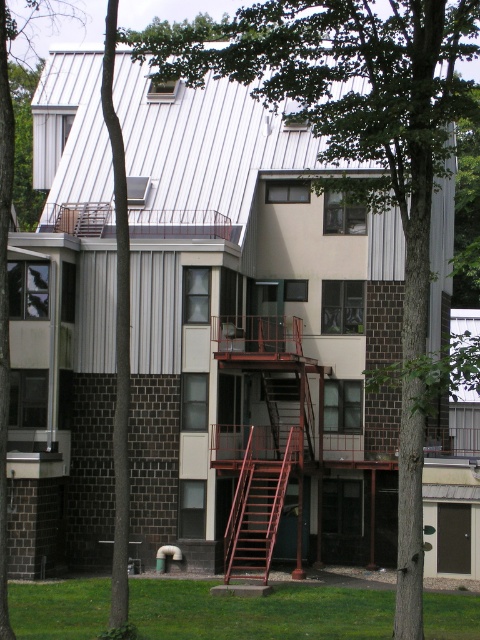
Question: Which object appears closest to the camera in this image?

Choices:
 (A) rusty metal fire escape at center
 (B) metallic red staircase at center
 (C) green leafy tree at center

Answer: (C)

Question: Does green leafy tree at center have a lesser width compared to metallic red staircase at center?

Choices:
 (A) yes
 (B) no

Answer: (B)

Question: Which point is farther from the camera taking this photo?

Choices:
 (A) (283, 385)
 (B) (3, 156)

Answer: (A)

Question: Is rusty metal staircase at center to the right of metallic red staircase at center from the viewer's perspective?

Choices:
 (A) yes
 (B) no

Answer: (B)

Question: Does green leafy tree at center come in front of metallic red staircase at center?

Choices:
 (A) yes
 (B) no

Answer: (A)

Question: Which point is farther to the camera?

Choices:
 (A) metallic red staircase at center
 (B) green leafy tree at center
 (C) rusty metal staircase at center
 (D) rusty metal fire escape at center

Answer: (A)